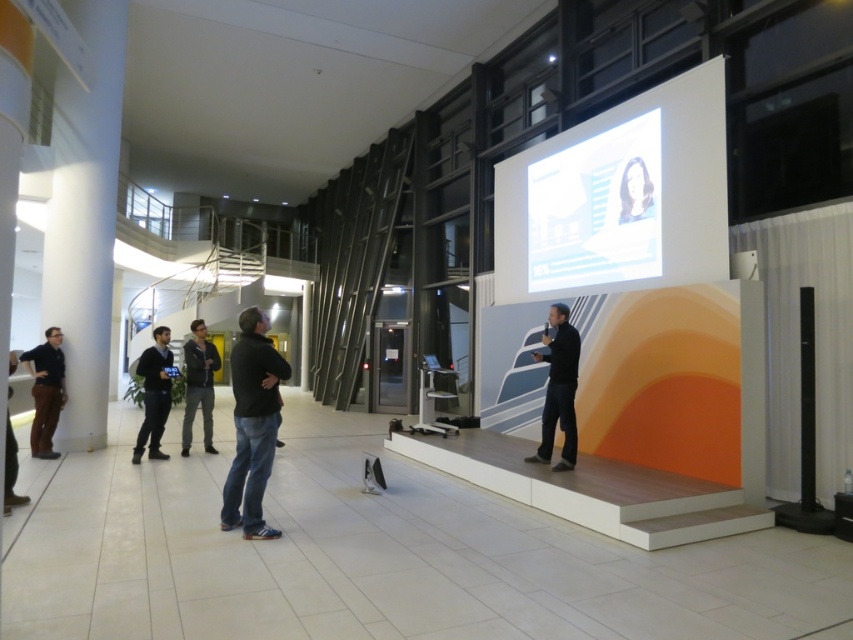
Which is more to the right, dark gray sweater at center or dark gray hoodie at center?

Positioned to the right is dark gray sweater at center.

Which is in front, point (264, 412) or point (187, 346)?

Point (264, 412)

Find the location of a particular element. The height and width of the screenshot is (640, 853). dark gray sweater at center is located at coordinates point(252,424).

Does matte black shirt at left appear under dark gray hoodie at center?

Incorrect, matte black shirt at left is not positioned below dark gray hoodie at center.

Does point (61, 385) come in front of point (200, 396)?

Yes, point (61, 385) is in front of point (200, 396).

Image resolution: width=853 pixels, height=640 pixels. I want to click on matte black shirt at left, so click(45, 392).

Can you confirm if white glossy projection screen at upper center is positioned to the left of matte black shirt at left?

In fact, white glossy projection screen at upper center is to the right of matte black shirt at left.

What do you see at coordinates (618, 196) in the screenshot? I see `white glossy projection screen at upper center` at bounding box center [618, 196].

Where is `white glossy projection screen at upper center`? The width and height of the screenshot is (853, 640). white glossy projection screen at upper center is located at coordinates (618, 196).